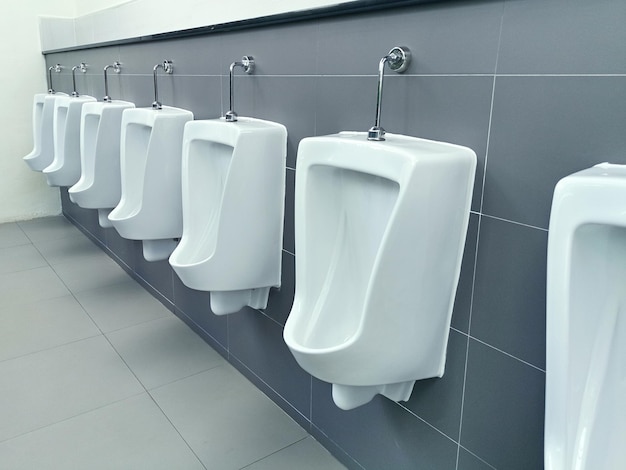
At what (x,y) coordinates should I click in order to perform the action: click on urinals. Please return your answer as a coordinate pair (x, y). Looking at the image, I should click on (39, 132), (59, 138), (99, 161), (146, 180), (201, 203), (316, 247), (573, 328).